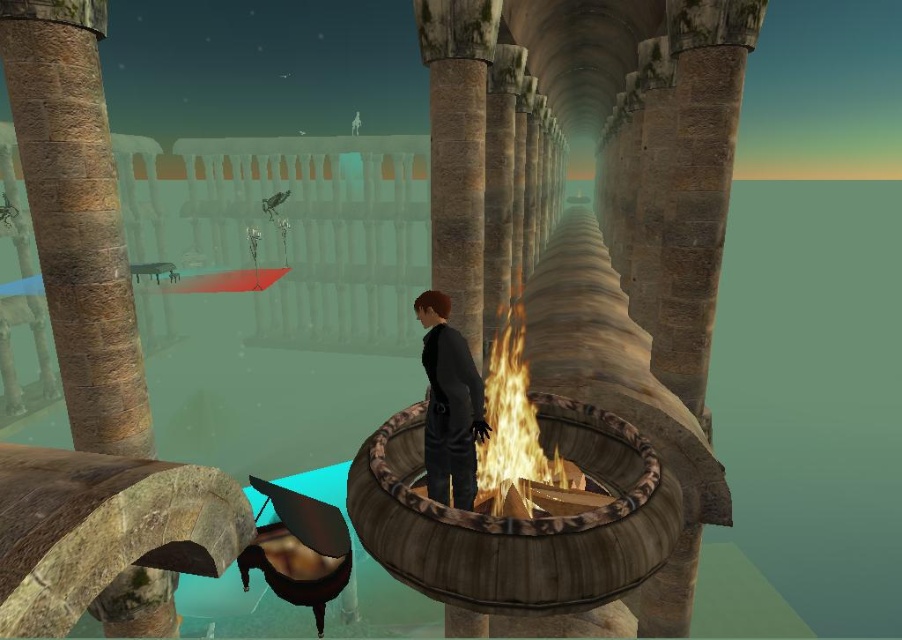
You are standing in the corridor and notice both the rustic wood fire pit at center and the dark matte coat at center. How far apart are these two items from each other?

The rustic wood fire pit at center is 1.08 meters away from the dark matte coat at center.

You are standing at the entrance of the colonnaded corridor and notice a point marked at coordinates (77, 216). Based on the scene description, which object does this point correspond to?

The point at coordinates (77, 216) corresponds to the brown stone pillar at left.